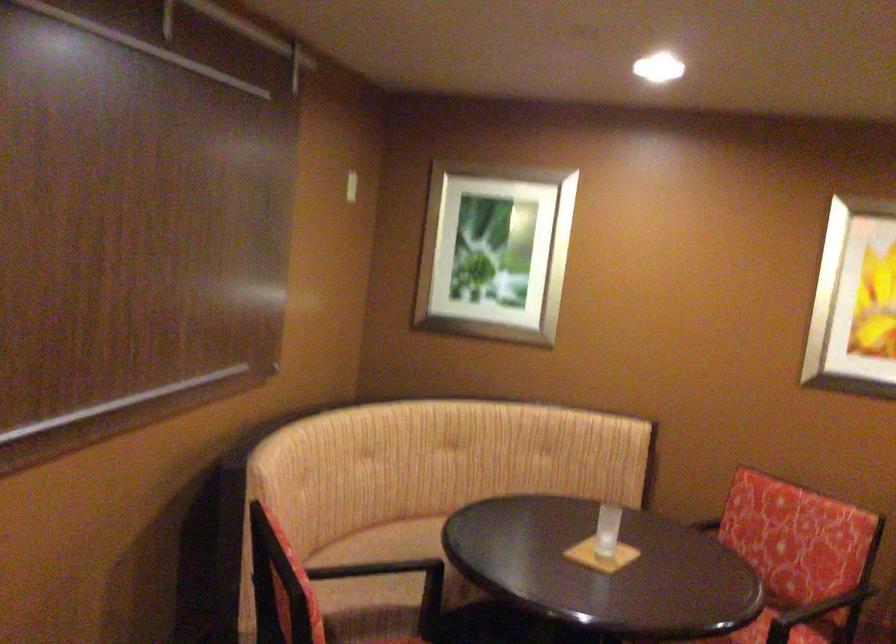
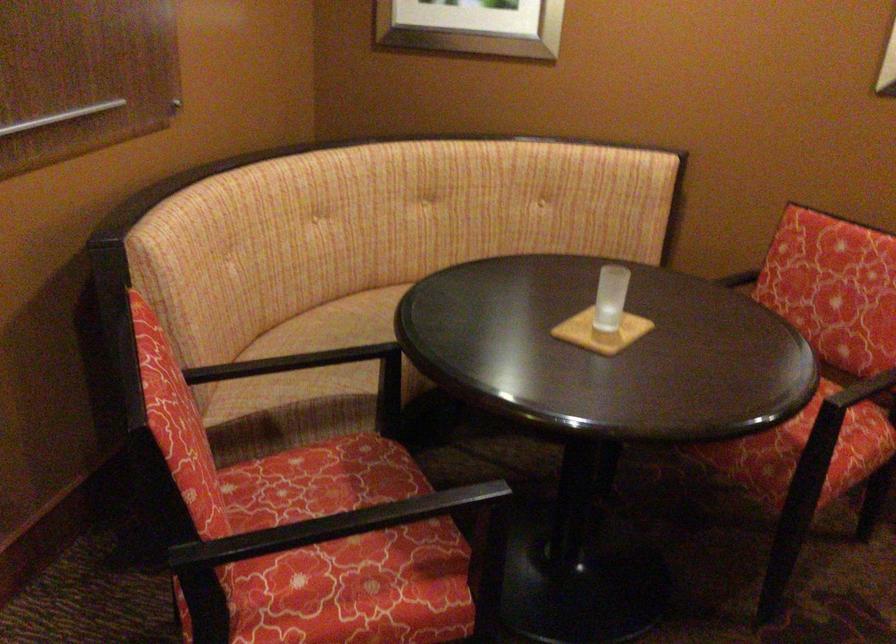
Find the pixel in the second image that matches [397,583] in the first image.

(362, 357)